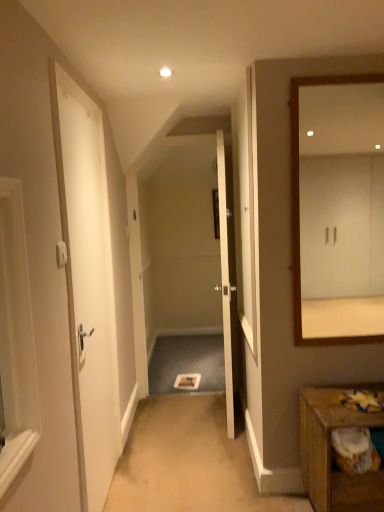
Question: Is white matte door at left, arranged as the 2th door when viewed from the right, looking in the opposite direction of wooden table at lower right?

Choices:
 (A) no
 (B) yes

Answer: (A)

Question: Is white matte door at left, the 1th door from the left, aimed at wooden table at lower right?

Choices:
 (A) yes
 (B) no

Answer: (A)

Question: Is white matte door at left, arranged as the 2th door when viewed from the right, at the right side of wooden table at lower right?

Choices:
 (A) yes
 (B) no

Answer: (B)

Question: Does white matte door at left, placed as the 1th door when sorted from front to back, have a larger size compared to wooden table at lower right?

Choices:
 (A) no
 (B) yes

Answer: (A)

Question: Would you say white matte door at left, placed as the 1th door when sorted from front to back, is outside wooden table at lower right?

Choices:
 (A) yes
 (B) no

Answer: (A)

Question: From the image's perspective, is white matte door at left, arranged as the 2th door when viewed from the right, above wooden table at lower right?

Choices:
 (A) no
 (B) yes

Answer: (B)

Question: Does white glossy door at center, the first door from the right, have a lesser width compared to white matte door at left, arranged as the 2th door when viewed from the right?

Choices:
 (A) no
 (B) yes

Answer: (A)

Question: From the image's perspective, is white glossy door at center, acting as the 2th door starting from the front, below white matte door at left, the 1th door from the left?

Choices:
 (A) no
 (B) yes

Answer: (A)

Question: Considering the relative positions of white glossy door at center, the first door viewed from the back, and white matte door at left, the 1th door from the left, in the image provided, is white glossy door at center, the first door viewed from the back, to the left of white matte door at left, the 1th door from the left, from the viewer's perspective?

Choices:
 (A) yes
 (B) no

Answer: (B)

Question: Is white glossy door at center, which is the 2th door in left-to-right order, surrounding white matte door at left, the 1th door from the left?

Choices:
 (A) no
 (B) yes

Answer: (A)

Question: From the image's perspective, is white glossy door at center, which is the 2th door in left-to-right order, over white matte door at left, placed as the 1th door when sorted from front to back?

Choices:
 (A) yes
 (B) no

Answer: (A)

Question: Is white glossy door at center, which is the 2th door in left-to-right order, not close to white matte door at left, placed as the 1th door when sorted from front to back?

Choices:
 (A) no
 (B) yes

Answer: (A)

Question: Considering the relative sizes of white wooden mirror at right and white matte door at left, the 1th door from the left, in the image provided, is white wooden mirror at right smaller than white matte door at left, the 1th door from the left,?

Choices:
 (A) yes
 (B) no

Answer: (A)